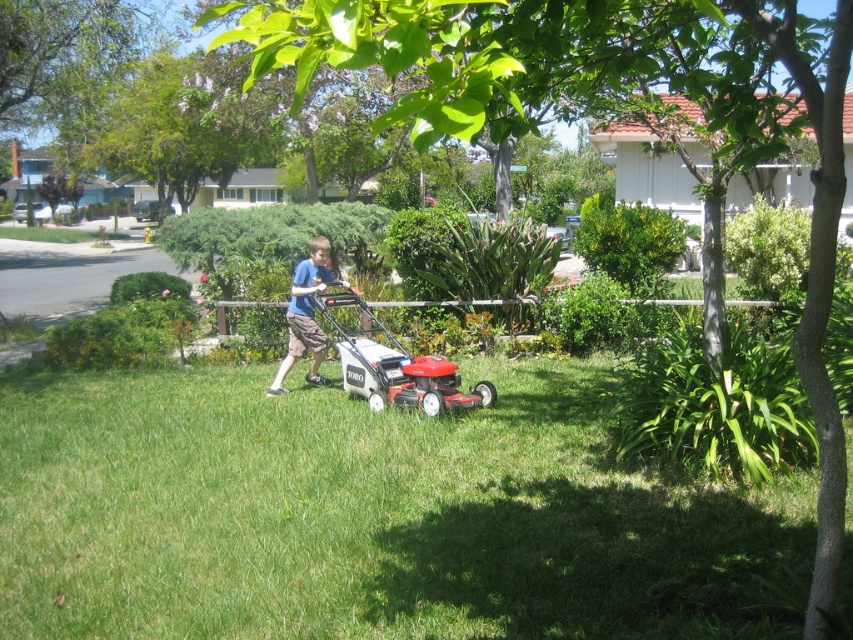
Which of these two, green grass at center or blue cotton shirt at center, stands taller?

blue cotton shirt at center

Does point (73, 484) come in front of point (320, 336)?

Yes, point (73, 484) is closer to viewer.

Locate an element on the screen. The image size is (853, 640). green grass at center is located at coordinates (369, 515).